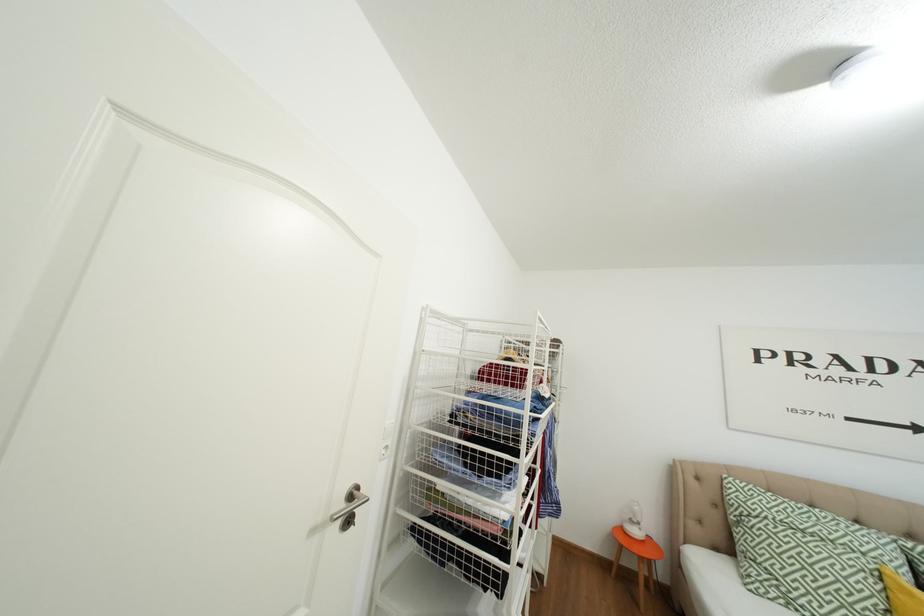
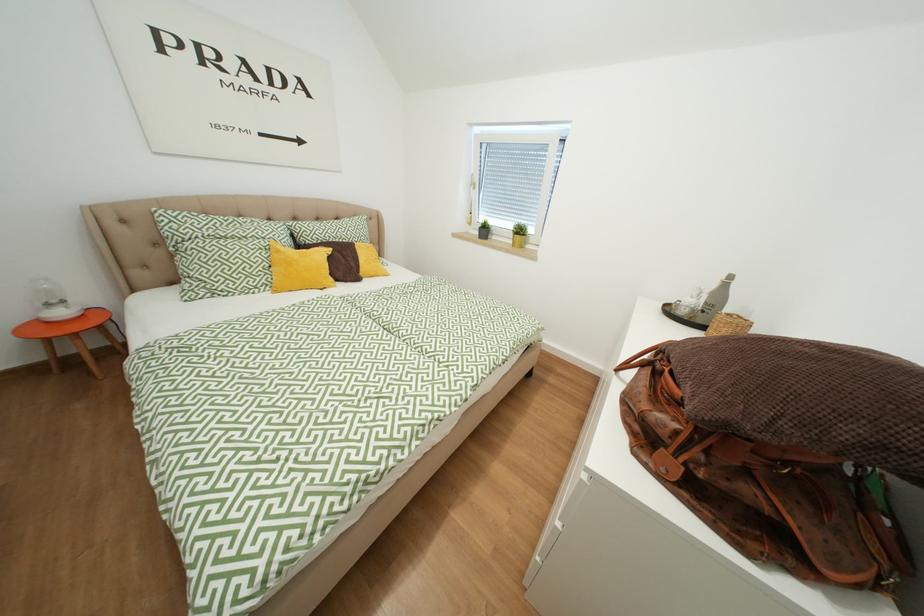
From the picture: The images are taken continuously from a first-person perspective. In which direction is your viewpoint rotating?

The rotation direction of the camera is right-down.